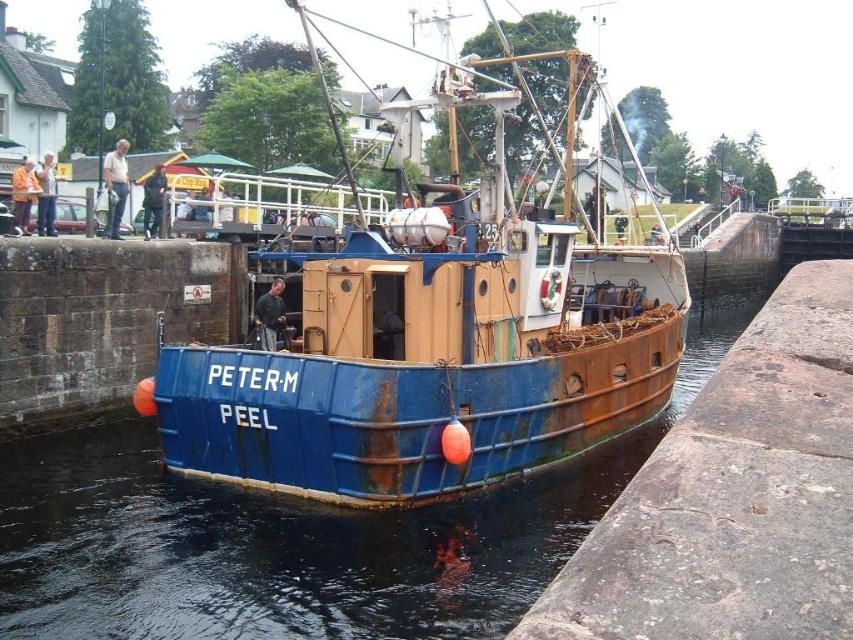
Question: Does rusty metal boat at center appear on the right side of rusty metal water at center?

Choices:
 (A) no
 (B) yes

Answer: (A)

Question: Is rusty metal boat at center wider than rusty metal water at center?

Choices:
 (A) yes
 (B) no

Answer: (B)

Question: Which of the following is the closest to the observer?

Choices:
 (A) rusty metal boat at center
 (B) rusty metal water at center

Answer: (B)

Question: Can you confirm if rusty metal boat at center is smaller than rusty metal water at center?

Choices:
 (A) no
 (B) yes

Answer: (A)